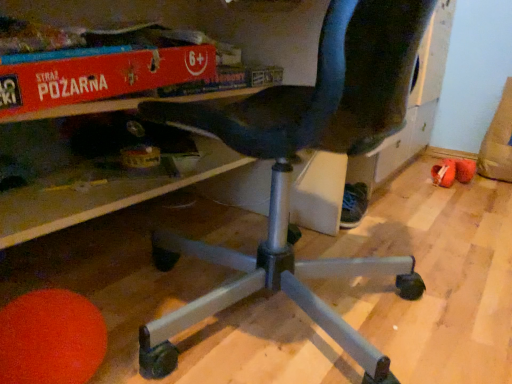
Locate an element on the screen. This screenshot has width=512, height=384. free space between black plastic chair at center and black fabric shoe at lower center, the second footwear from the back is located at coordinates (355, 239).